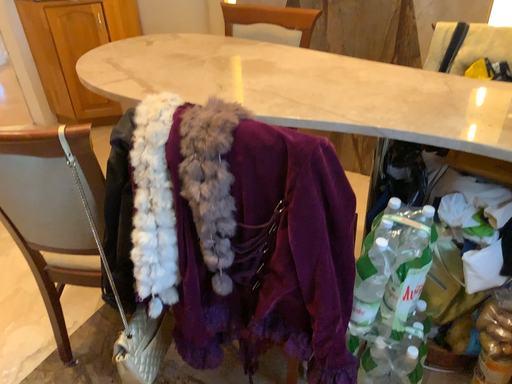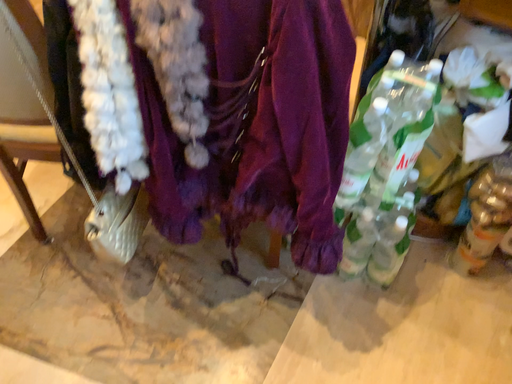
Question: How did the camera likely rotate when shooting the video?

Choices:
 (A) rotated downward
 (B) rotated upward

Answer: (A)